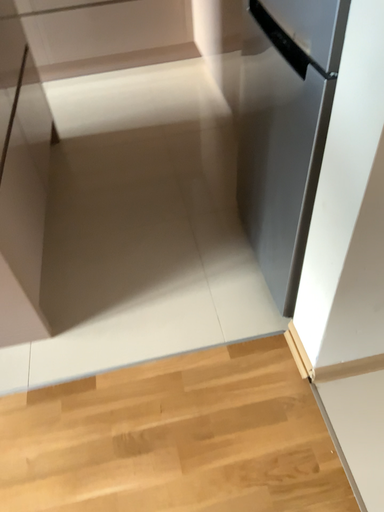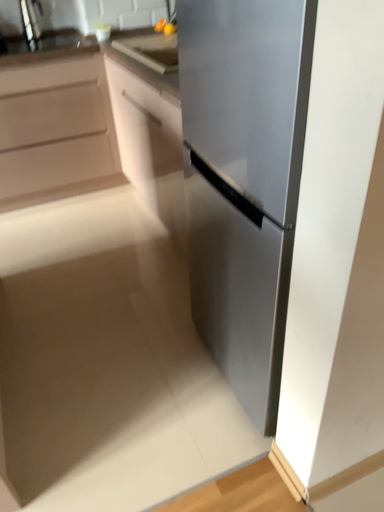
Question: How did the camera likely rotate when shooting the video?

Choices:
 (A) rotated left
 (B) rotated right

Answer: (B)